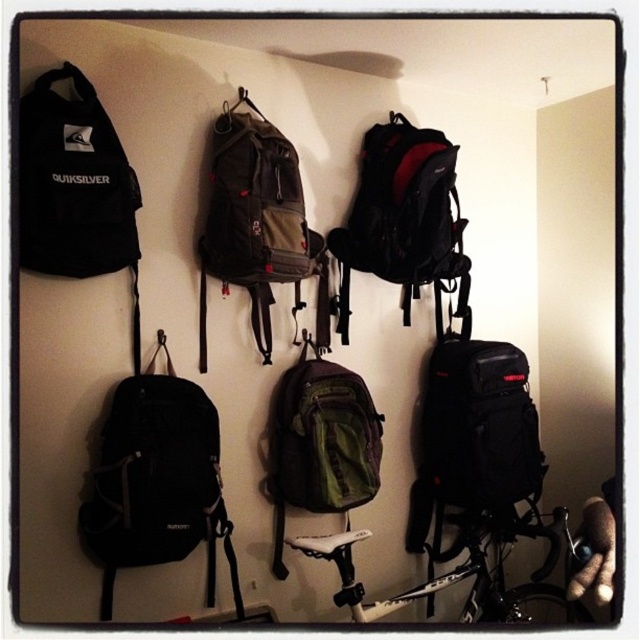
Can you confirm if black matte backpack at left is positioned to the right of camouflage fabric backpack at center?

In fact, black matte backpack at left is to the left of camouflage fabric backpack at center.

Does black matte backpack at left have a lesser width compared to camouflage fabric backpack at center?

In fact, black matte backpack at left might be wider than camouflage fabric backpack at center.

Who is more forward, (138,429) or (252,234)?

Positioned in front is point (138,429).

Locate an element on the screen. The width and height of the screenshot is (640, 640). black matte backpack at left is located at coordinates (156, 481).

Between point (216, 417) and point (346, 456), which one is positioned behind?

The point (346, 456) is behind.

Is black matte backpack at left to the left of green fabric backpack at center from the viewer's perspective?

Yes, black matte backpack at left is to the left of green fabric backpack at center.

Who is more forward, (216, 536) or (381, 413)?

Point (216, 536) is more forward.

Locate an element on the screen. The width and height of the screenshot is (640, 640). black matte backpack at left is located at coordinates (156, 481).

Can you confirm if matte black backpack at center is positioned below green fabric backpack at center?

No.

Who is more distant from viewer, (403, 220) or (305, 369)?

Positioned behind is point (403, 220).

Where is `matte black backpack at center`? matte black backpack at center is located at coordinates (401, 214).

At what (x,y) coordinates should I click in order to perform the action: click on matte black backpack at center. Please return your answer as a coordinate pair (x, y). The image size is (640, 640). Looking at the image, I should click on (401, 214).